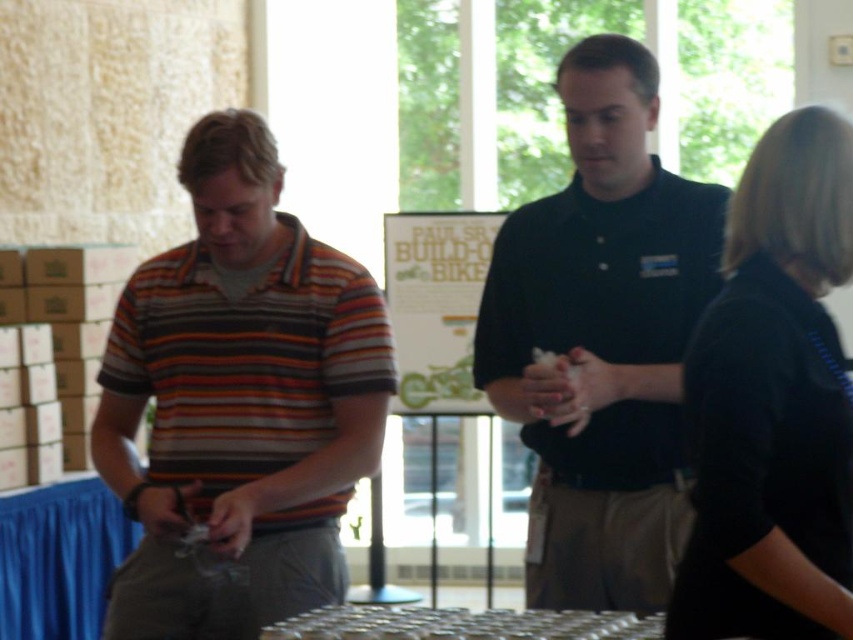
Based on the scene description, where is the dark blue shirt at center located in terms of coordinates?

The dark blue shirt at center is located at coordinates point [601,340].

You are organizing a photo shoot and need to arrange the subjects so that the dark blue shirt at center and the black matte shirt at right are visible to the camera. Given their heights, which subject should be positioned closer to the front to ensure both are visible?

The black matte shirt at right should be positioned closer to the front because the dark blue shirt at center is much taller, allowing both subjects to be visible in the photo.